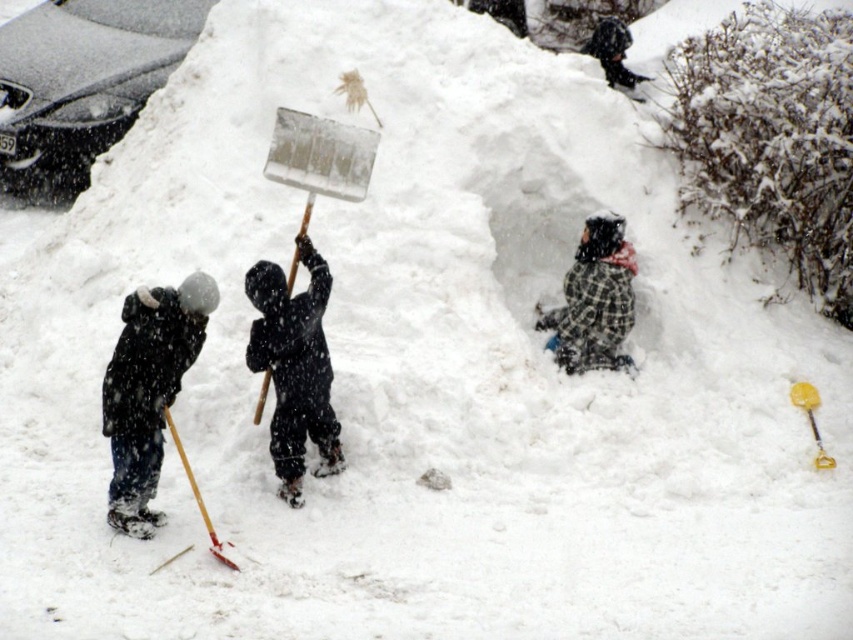
Between point (293, 376) and point (572, 353), which one is positioned behind?

Positioned behind is point (572, 353).

Does black matte snow shovel at center have a lesser height compared to plaid fabric at center?

Incorrect, black matte snow shovel at center's height does not fall short of plaid fabric at center's.

Who is more distant from viewer, (x=317, y=298) or (x=577, y=275)?

The point (x=577, y=275) is behind.

Where is `black matte snow shovel at center`? black matte snow shovel at center is located at coordinates (294, 368).

Who is lower down, black matte snowsuit at left or dark gray hooded jacket at upper center?

black matte snowsuit at left

Can you confirm if black matte snowsuit at left is positioned above dark gray hooded jacket at upper center?

No.

This screenshot has width=853, height=640. Identify the location of black matte snowsuit at left. (148, 390).

The height and width of the screenshot is (640, 853). In order to click on black matte snowsuit at left in this screenshot , I will do `click(148, 390)`.

Which is more to the left, plaid fabric at center or wooden shovel at lower left?

wooden shovel at lower left

Can you confirm if plaid fabric at center is positioned below wooden shovel at lower left?

No, plaid fabric at center is not below wooden shovel at lower left.

Describe the element at coordinates (595, 300) in the screenshot. I see `plaid fabric at center` at that location.

At what (x,y) coordinates should I click in order to perform the action: click on plaid fabric at center. Please return your answer as a coordinate pair (x, y). The width and height of the screenshot is (853, 640). Looking at the image, I should click on (595, 300).